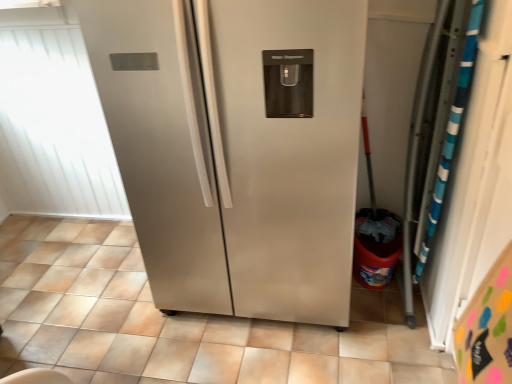
Question: Considering the relative sizes of white matte window screen at upper left and satin silver refrigerator at center in the image provided, is white matte window screen at upper left shorter than satin silver refrigerator at center?

Choices:
 (A) no
 (B) yes

Answer: (A)

Question: Can you confirm if white matte window screen at upper left is positioned to the right of satin silver refrigerator at center?

Choices:
 (A) no
 (B) yes

Answer: (A)

Question: Does white matte window screen at upper left have a smaller size compared to satin silver refrigerator at center?

Choices:
 (A) no
 (B) yes

Answer: (A)

Question: Does white matte window screen at upper left have a greater height compared to satin silver refrigerator at center?

Choices:
 (A) no
 (B) yes

Answer: (B)

Question: Would you say satin silver refrigerator at center is part of white matte window screen at upper left's contents?

Choices:
 (A) no
 (B) yes

Answer: (A)

Question: Can you confirm if white matte window screen at upper left is thinner than satin silver refrigerator at center?

Choices:
 (A) yes
 (B) no

Answer: (A)

Question: Considering the relative positions of satin silver refrigerator at center and white matte window screen at upper left in the image provided, is satin silver refrigerator at center in front of white matte window screen at upper left?

Choices:
 (A) yes
 (B) no

Answer: (A)

Question: Is satin silver refrigerator at center wider than white matte window screen at upper left?

Choices:
 (A) yes
 (B) no

Answer: (A)

Question: From a real-world perspective, is satin silver refrigerator at center on top of white matte window screen at upper left?

Choices:
 (A) no
 (B) yes

Answer: (A)

Question: Is satin silver refrigerator at center smaller than white matte window screen at upper left?

Choices:
 (A) yes
 (B) no

Answer: (A)

Question: Is white matte window screen at upper left at the back of satin silver refrigerator at center?

Choices:
 (A) yes
 (B) no

Answer: (B)

Question: Is satin silver refrigerator at center facing towards white matte window screen at upper left?

Choices:
 (A) no
 (B) yes

Answer: (A)

Question: From a real-world perspective, is white matte window screen at upper left above or below satin silver refrigerator at center?

Choices:
 (A) above
 (B) below

Answer: (A)